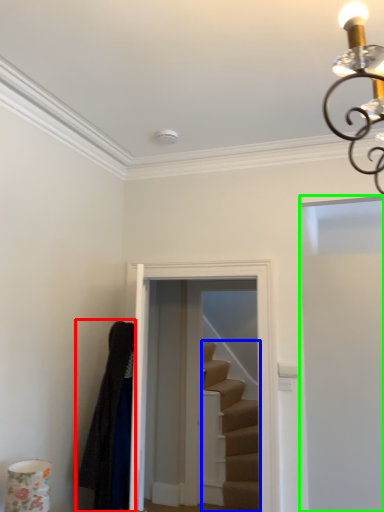
Question: Based on their relative distances, which object is farther from robe (highlighted by a red box)? Choose from stairs (highlighted by a blue box) and door (highlighted by a green box).

Choices:
 (A) stairs
 (B) door

Answer: (A)